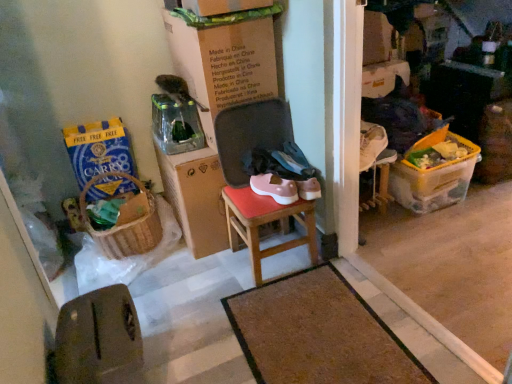
Question: In terms of height, does brown leather chair at lower left look taller or shorter compared to wooden stool at center?

Choices:
 (A) tall
 (B) short

Answer: (A)

Question: Relative to wooden stool at center, is brown leather chair at lower left in front or behind?

Choices:
 (A) behind
 (B) front

Answer: (B)

Question: Estimate the real-world distances between objects in this image. Which object is closer to the woven brown picnic basket at lower left?

Choices:
 (A) yellow plastic container at right, placed as the first box when sorted from right to left
 (B) blue paper bag at left, arranged as the second box when viewed from the right
 (C) brown leather chair at lower left
 (D) brown textured mat at center
 (E) cardboard box at center

Answer: (B)

Question: Which object is the closest to the brown textured mat at center?

Choices:
 (A) yellow plastic container at right, which is the 2th box in left-to-right order
 (B) cardboard box at center
 (C) woven brown picnic basket at lower left
 (D) blue paper bag at left, which is the first box in left-to-right order
 (E) wooden stool at center

Answer: (E)